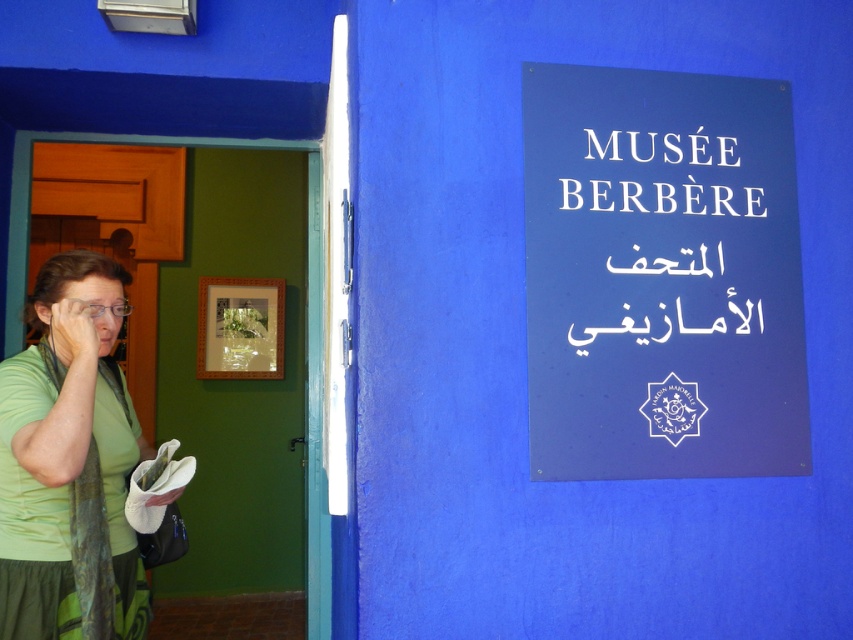
Is blue plastic sign at upper right smaller than translucent plastic nose at center?

Incorrect, blue plastic sign at upper right is not smaller in size than translucent plastic nose at center.

Is blue plastic sign at upper right bigger than translucent plastic nose at center?

Correct, blue plastic sign at upper right is larger in size than translucent plastic nose at center.

Where is `blue plastic sign at upper right`? blue plastic sign at upper right is located at coordinates (660, 276).

Is blue plastic sign at upper right shorter than white plastic sign at upper right?

In fact, blue plastic sign at upper right may be taller than white plastic sign at upper right.

Who is more forward, (697, 285) or (665, 205)?

Positioned in front is point (697, 285).

The height and width of the screenshot is (640, 853). In order to click on blue plastic sign at upper right in this screenshot , I will do `click(660, 276)`.

Does blue plastic sign at upper right appear on the right side of green fabric scarf at left?

Indeed, blue plastic sign at upper right is positioned on the right side of green fabric scarf at left.

The image size is (853, 640). Describe the element at coordinates (660, 276) in the screenshot. I see `blue plastic sign at upper right` at that location.

I want to click on blue plastic sign at upper right, so tap(660, 276).